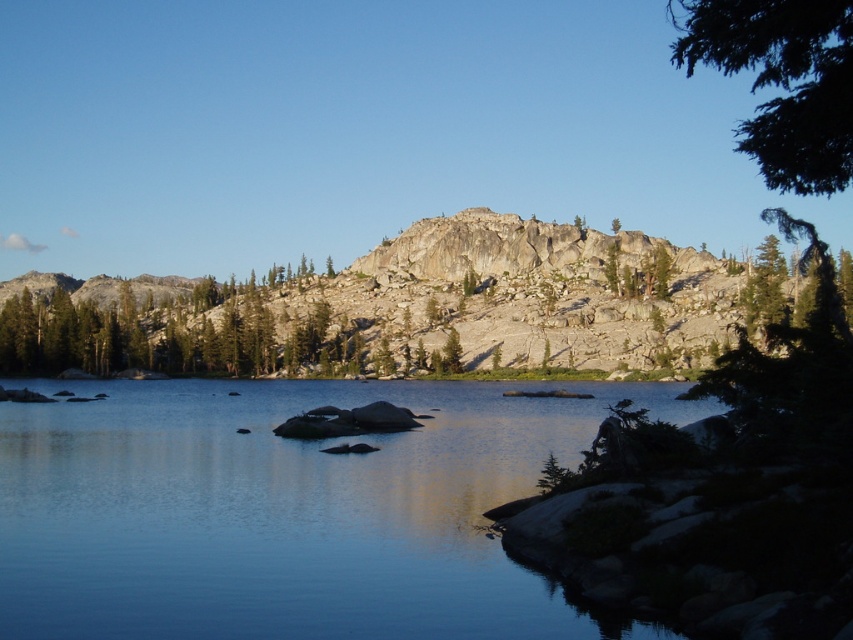
Can you confirm if green leafy tree at upper right is positioned to the right of green textured tree at center?

Indeed, green leafy tree at upper right is positioned on the right side of green textured tree at center.

From the picture: Between green leafy tree at upper right and green textured tree at center, which one is positioned higher?

green leafy tree at upper right is above.

This screenshot has width=853, height=640. Describe the element at coordinates (781, 81) in the screenshot. I see `green leafy tree at upper right` at that location.

At what (x,y) coordinates should I click in order to perform the action: click on green leafy tree at upper right. Please return your answer as a coordinate pair (x, y). This screenshot has height=640, width=853. Looking at the image, I should click on (781, 81).

Can you confirm if clear water at center is bigger than granite rock formation at center?

Incorrect, clear water at center is not larger than granite rock formation at center.

Between point (24, 580) and point (764, 310), which one is positioned behind?

The point (764, 310) is more distant.

This screenshot has height=640, width=853. What do you see at coordinates (287, 512) in the screenshot?
I see `clear water at center` at bounding box center [287, 512].

You are a GUI agent. You are given a task and a screenshot of the screen. Output one action in this format:
    pyautogui.click(x=<x>, y=<y>)
    Task: Click on the clear water at center
    
    Given the screenshot: What is the action you would take?
    pyautogui.click(x=287, y=512)

Does granite rock formation at center have a lesser height compared to green leafy tree at upper right?

Yes.

Which is above, granite rock formation at center or green leafy tree at upper right?

Positioned higher is green leafy tree at upper right.

Is point (677, 298) positioned after point (737, 24)?

Yes, point (677, 298) is farther from viewer.

The image size is (853, 640). Find the location of `granite rock formation at center`. granite rock formation at center is located at coordinates (415, 307).